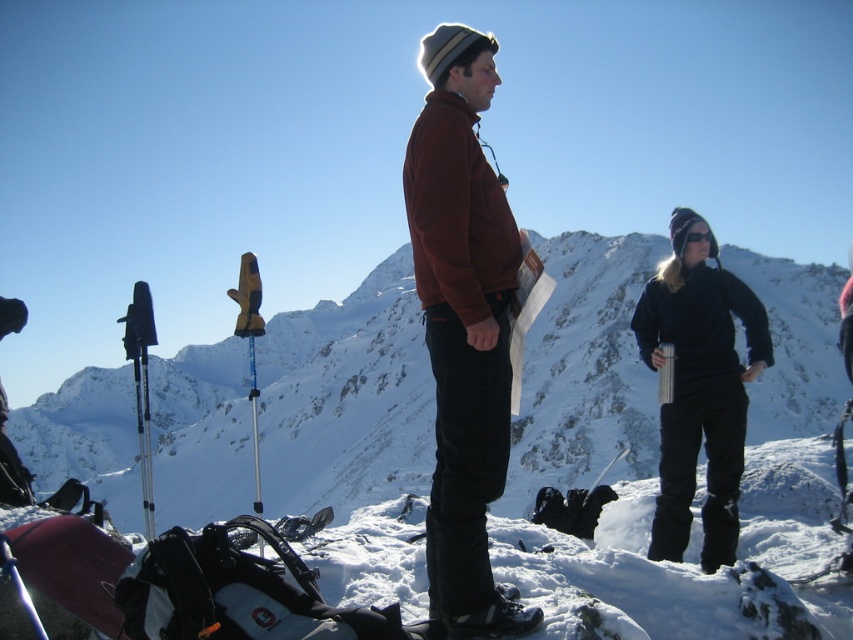
You are planning to take a photo of the white snow at center and the black matte snow pants at right. Which object should you focus on first if you want both to be in sharp focus?

The black matte snow pants at right should be focused on first because it is closer to the camera than the white snow at center, ensuring both will be in focus when using depth of field techniques.

You are planning to take a photo of the white snow at center and the black matte snow pants at right. Which object will occupy more horizontal space in the photo?

The white snow at center will occupy more horizontal space in the photo because its width surpasses that of the black matte snow pants at right.

You are a photographer trying to capture a photo of the brown fleece jacket at center and the black matte snow pants at right. Since you want both subjects to be in the frame, which one should you position closer to the left side of the camera frame to ensure they are both visible?

The brown fleece jacket at center is positioned on the left side of black matte snow pants at right, so to include both in the frame, you should position the brown fleece jacket at center closer to the left side of the camera frame.